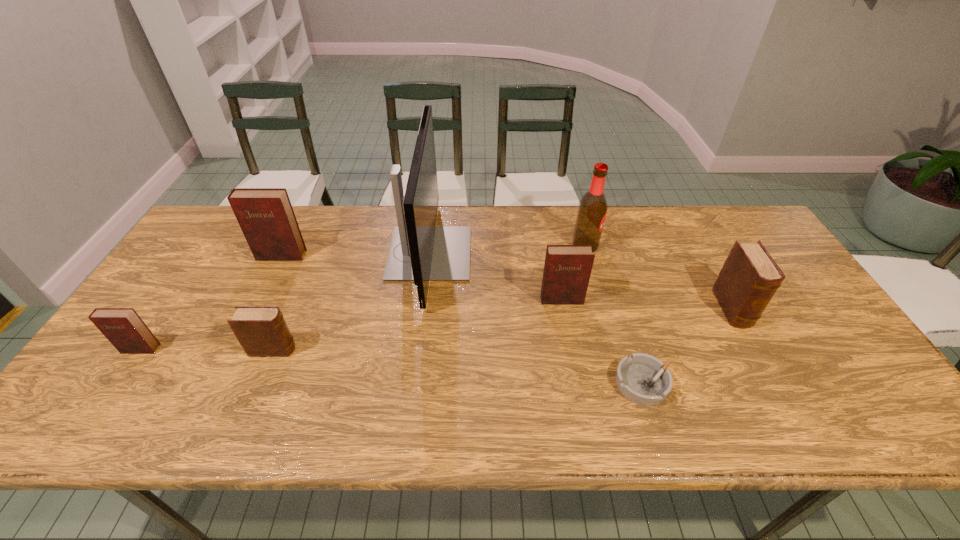
Locate an element on the screen. This screenshot has width=960, height=540. free space that satisfies the following two spatial constraints: 1. on the front cover of the second diary from right to left; 2. on the spine side of the smaller brown diary is located at coordinates (570, 349).

This screenshot has width=960, height=540. What are the coordinates of `free space that satisfies the following two spatial constraints: 1. on the screen of the tallest object; 2. on the back side of the shortest object` in the screenshot? It's located at (414, 383).

I want to click on blank space that satisfies the following two spatial constraints: 1. on the front cover of the second biggest reddish-brown diary; 2. on the right side of the shortest object, so click(x=577, y=383).